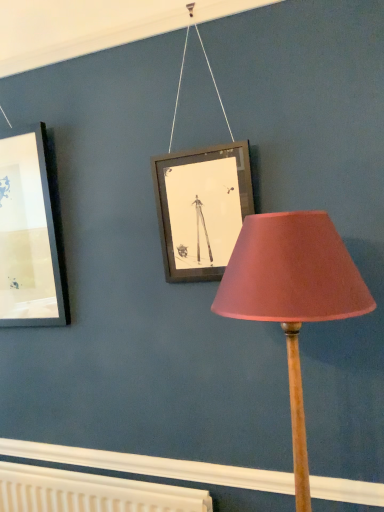
In order to click on white textured radiator at lower center in this screenshot , I will do `click(90, 492)`.

Image resolution: width=384 pixels, height=512 pixels. Describe the element at coordinates (90, 492) in the screenshot. I see `white textured radiator at lower center` at that location.

In order to face pink fabric lampshade at center, should I rotate leftwards or rightwards?

You should look right and rotate roughly 13.513 degrees.

The height and width of the screenshot is (512, 384). Describe the element at coordinates (292, 296) in the screenshot. I see `pink fabric lampshade at center` at that location.

You are a GUI agent. You are given a task and a screenshot of the screen. Output one action in this format:
    pyautogui.click(x=<x>, y=<y>)
    Task: Click on the pink fabric lampshade at center
    Image resolution: width=384 pixels, height=512 pixels.
    Given the screenshot: What is the action you would take?
    pyautogui.click(x=292, y=296)

At what (x,y) coordinates should I click in order to perform the action: click on white textured radiator at lower center. Please return your answer as a coordinate pair (x, y). This screenshot has height=512, width=384. Looking at the image, I should click on (90, 492).

Considering the relative positions of white textured radiator at lower center and pink fabric lampshade at center in the image provided, is white textured radiator at lower center to the left of pink fabric lampshade at center from the viewer's perspective?

Correct, you'll find white textured radiator at lower center to the left of pink fabric lampshade at center.

Which object is more forward, white textured radiator at lower center or pink fabric lampshade at center?

Result: pink fabric lampshade at center is more forward.

Is point (89, 505) farther from viewer compared to point (302, 297)?

That is True.

From the image's perspective, is white textured radiator at lower center located above pink fabric lampshade at center?

No, from the image's perspective, white textured radiator at lower center is not on top of pink fabric lampshade at center.

Consider the image. From a real-world perspective, is white textured radiator at lower center on top of pink fabric lampshade at center?

Actually, white textured radiator at lower center is physically below pink fabric lampshade at center in the real world.

Which object is thinner, white textured radiator at lower center or pink fabric lampshade at center?

Thinner between the two is white textured radiator at lower center.

Which of these two, white textured radiator at lower center or pink fabric lampshade at center, stands taller?

pink fabric lampshade at center is taller.

Considering the relative sizes of white textured radiator at lower center and pink fabric lampshade at center in the image provided, is white textured radiator at lower center bigger than pink fabric lampshade at center?

Actually, white textured radiator at lower center might be smaller than pink fabric lampshade at center.

Based on the photo, which is correct: white textured radiator at lower center is inside pink fabric lampshade at center, or outside of it?

white textured radiator at lower center exists outside the volume of pink fabric lampshade at center.

Is white textured radiator at lower center in contact with pink fabric lampshade at center?

white textured radiator at lower center and pink fabric lampshade at center are not in contact.

Is white textured radiator at lower center positioned with its back to pink fabric lampshade at center?

Answer: That's not correct — white textured radiator at lower center is not looking away from pink fabric lampshade at center.

There is a white textured radiator at lower center. At what (x,y) coordinates should I click in order to perform the action: click on lamp above it (from a real-world perspective). Please return your answer as a coordinate pair (x, y). Looking at the image, I should click on (292, 296).

Considering the relative positions of pink fabric lampshade at center and white textured radiator at lower center in the image provided, is pink fabric lampshade at center to the left of white textured radiator at lower center from the viewer's perspective?

In fact, pink fabric lampshade at center is to the right of white textured radiator at lower center.

Is pink fabric lampshade at center in front of or behind white textured radiator at lower center in the image?

In the image, pink fabric lampshade at center appears in front of white textured radiator at lower center.

Considering the positions of point (245, 316) and point (131, 506), is point (245, 316) closer or farther from the camera than point (131, 506)?

Point (245, 316) appears to be closer to the viewer than point (131, 506).

From the image's perspective, is pink fabric lampshade at center located beneath white textured radiator at lower center?

Actually, pink fabric lampshade at center appears above white textured radiator at lower center in the image.

From a real-world perspective, is pink fabric lampshade at center positioned above or below white textured radiator at lower center?

In terms of real-world spatial position, pink fabric lampshade at center is above white textured radiator at lower center.

Does pink fabric lampshade at center have a greater width compared to white textured radiator at lower center?

Correct, the width of pink fabric lampshade at center exceeds that of white textured radiator at lower center.

In the scene shown: Is pink fabric lampshade at center shorter than white textured radiator at lower center?

No, pink fabric lampshade at center is not shorter than white textured radiator at lower center.

In terms of size, does pink fabric lampshade at center appear bigger or smaller than white textured radiator at lower center?

In the image, pink fabric lampshade at center appears to be larger than white textured radiator at lower center.

Is pink fabric lampshade at center inside the boundaries of white textured radiator at lower center, or outside?

The correct answer is: outside.

Is pink fabric lampshade at center in contact with white textured radiator at lower center?

pink fabric lampshade at center and white textured radiator at lower center are not in contact.

Is pink fabric lampshade at center oriented towards white textured radiator at lower center?

No, pink fabric lampshade at center is not facing towards white textured radiator at lower center.

Looking at this image, what's the angular difference between pink fabric lampshade at center and white textured radiator at lower center's facing directions?

The facing directions of pink fabric lampshade at center and white textured radiator at lower center are 1.3 degrees apart.

How much distance is there between pink fabric lampshade at center and white textured radiator at lower center?

pink fabric lampshade at center is 36.31 inches away from white textured radiator at lower center.

The image size is (384, 512). In the image, there is a white textured radiator at lower center. Identify the location of lamp above it (from the image's perspective). (292, 296).

I want to click on lamp in front of the white textured radiator at lower center, so click(x=292, y=296).

In the image, there is a pink fabric lampshade at center. Identify the location of radiator below it (from the image's perspective). Image resolution: width=384 pixels, height=512 pixels. pyautogui.click(x=90, y=492).